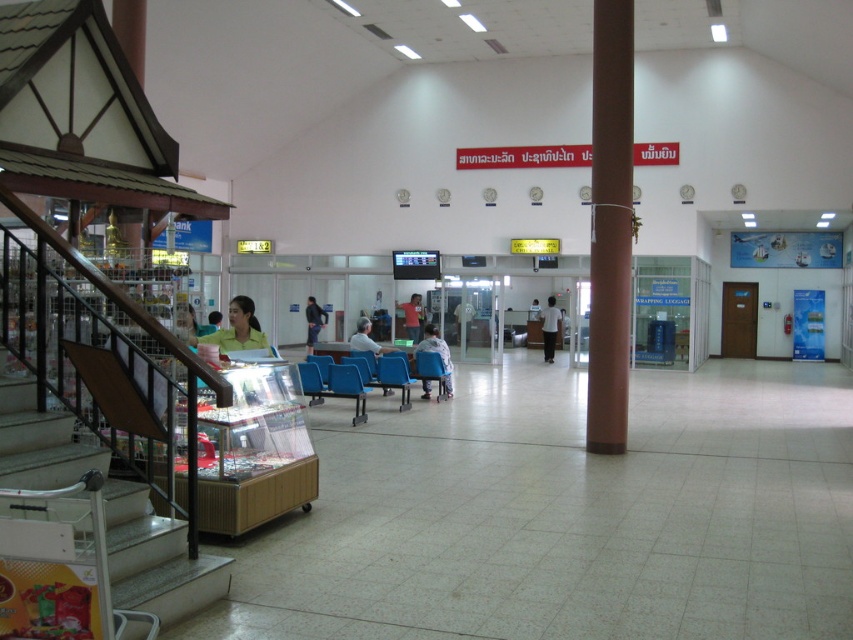
Which of these two, light blue fabric chair at center or matte blue chair at center, stands taller?

With more height is matte blue chair at center.

Does light blue fabric chair at center have a lesser height compared to matte blue chair at center?

Indeed, light blue fabric chair at center has a lesser height compared to matte blue chair at center.

Is point (447, 372) in front of point (376, 348)?

Yes, point (447, 372) is closer to viewer.

This screenshot has width=853, height=640. Identify the location of light blue fabric chair at center. (437, 353).

Who is shorter, brown polished column at center or matte blue chair at center?

A: With less height is matte blue chair at center.

Does brown polished column at center appear on the left side of matte blue chair at center?

No, brown polished column at center is not to the left of matte blue chair at center.

Measure the distance between point [625,436] and camera.

9.68 meters

Locate an element on the screen. The width and height of the screenshot is (853, 640). brown polished column at center is located at coordinates (610, 225).

In the scene shown: Measure the distance between white shirt at center and light brown leather jacket at center.

The distance of white shirt at center from light brown leather jacket at center is 13.07 feet.

Is white shirt at center shorter than light brown leather jacket at center?

Indeed, white shirt at center has a lesser height compared to light brown leather jacket at center.

Locate an element on the screen. The width and height of the screenshot is (853, 640). white shirt at center is located at coordinates (549, 326).

What are the coordinates of `white shirt at center` in the screenshot? It's located at (549, 326).